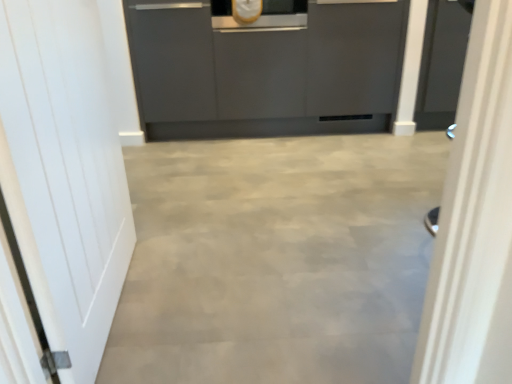
Question: From a real-world perspective, is white glossy door at right, the first door viewed from the right, located higher than white matte door at left, the 2th door when ordered from right to left?

Choices:
 (A) yes
 (B) no

Answer: (B)

Question: Can you confirm if white glossy door at right, which ranks as the second door in left-to-right order, is positioned to the right of white matte door at left, the first door when ordered from left to right?

Choices:
 (A) no
 (B) yes

Answer: (B)

Question: Can you confirm if white glossy door at right, the first door viewed from the right, is thinner than white matte door at left, the first door when ordered from left to right?

Choices:
 (A) no
 (B) yes

Answer: (A)

Question: From the image's perspective, would you say white glossy door at right, which ranks as the second door in left-to-right order, is positioned over white matte door at left, the 2th door when ordered from right to left?

Choices:
 (A) no
 (B) yes

Answer: (B)

Question: Is white glossy door at right, the first door viewed from the right, positioned with its back to white matte door at left, the 2th door when ordered from right to left?

Choices:
 (A) no
 (B) yes

Answer: (B)

Question: Can we say white glossy door at right, the first door viewed from the right, lies outside white matte door at left, the first door when ordered from left to right?

Choices:
 (A) no
 (B) yes

Answer: (B)

Question: Does matte gray cabinetry at center have a smaller size compared to white glossy door at right, the first door viewed from the right?

Choices:
 (A) yes
 (B) no

Answer: (B)

Question: Considering the relative positions of matte gray cabinetry at center and white glossy door at right, the first door viewed from the right, in the image provided, is matte gray cabinetry at center to the left of white glossy door at right, the first door viewed from the right, from the viewer's perspective?

Choices:
 (A) yes
 (B) no

Answer: (A)

Question: Does matte gray cabinetry at center turn towards white glossy door at right, which ranks as the second door in left-to-right order?

Choices:
 (A) no
 (B) yes

Answer: (B)

Question: Considering the relative sizes of matte gray cabinetry at center and white glossy door at right, the first door viewed from the right, in the image provided, is matte gray cabinetry at center shorter than white glossy door at right, the first door viewed from the right,?

Choices:
 (A) yes
 (B) no

Answer: (B)

Question: Is matte gray cabinetry at center next to white glossy door at right, the first door viewed from the right?

Choices:
 (A) no
 (B) yes

Answer: (A)

Question: From a real-world perspective, is matte gray cabinetry at center located higher than white glossy door at right, the first door viewed from the right?

Choices:
 (A) no
 (B) yes

Answer: (B)